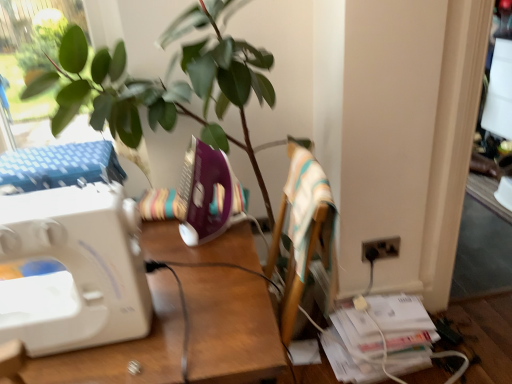
Question: In the image, is white plastic sewing machine at left positioned in front of or behind black plastic electric outlet at lower right?

Choices:
 (A) front
 (B) behind

Answer: (A)

Question: Is point (166, 377) closer or farther from the camera than point (374, 246)?

Choices:
 (A) farther
 (B) closer

Answer: (B)

Question: Based on their relative distances, which object is nearer to the purple plastic sewing machine at center, which is the first sewing machine in right-to-left order?

Choices:
 (A) white plastic sewing machine at left
 (B) white plastic sewing machine at left, placed as the 2th sewing machine when sorted from right to left
 (C) black plastic electric outlet at lower right
 (D) striped fabric armchair at center

Answer: (A)

Question: Estimate the real-world distances between objects in this image. Which object is closer to the white plastic sewing machine at left?

Choices:
 (A) purple plastic sewing machine at center, the second sewing machine when ordered from left to right
 (B) white plastic sewing machine at left, the 2th sewing machine in the back-to-front sequence
 (C) striped fabric armchair at center
 (D) black plastic electric outlet at lower right

Answer: (B)